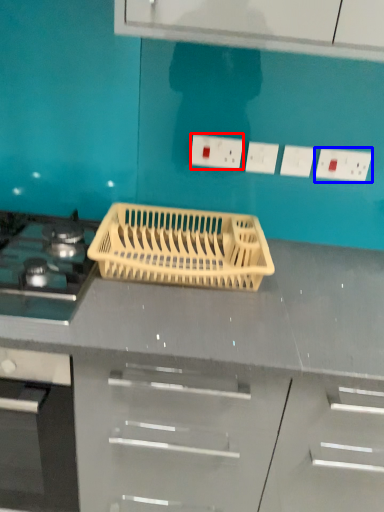
Question: Which point is further to the camera, electric outlet (highlighted by a red box) or electric outlet (highlighted by a blue box)?

Choices:
 (A) electric outlet
 (B) electric outlet

Answer: (A)